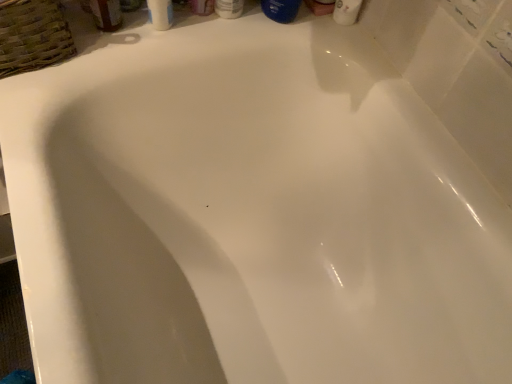
Question: From the image's perspective, would you say matte plastic bottle at upper center, the second toiletry from the right, is shown under woven brown basket at upper left?

Choices:
 (A) yes
 (B) no

Answer: (B)

Question: Does matte plastic bottle at upper center, the second toiletry from the right, have a larger size compared to woven brown basket at upper left?

Choices:
 (A) yes
 (B) no

Answer: (B)

Question: Can you confirm if matte plastic bottle at upper center, the first toiletry when ordered from left to right, is smaller than woven brown basket at upper left?

Choices:
 (A) yes
 (B) no

Answer: (A)

Question: From a real-world perspective, is matte plastic bottle at upper center, the second toiletry from the right, over woven brown basket at upper left?

Choices:
 (A) yes
 (B) no

Answer: (A)

Question: Can you confirm if matte plastic bottle at upper center, the second toiletry from the right, is thinner than woven brown basket at upper left?

Choices:
 (A) yes
 (B) no

Answer: (A)

Question: Can you confirm if matte plastic bottle at upper center, the second toiletry from the right, is positioned to the left of woven brown basket at upper left?

Choices:
 (A) no
 (B) yes

Answer: (A)

Question: Does white glossy bottle at upper center, the 1th toiletry in the right-to-left sequence, have a lesser height compared to translucent plastic mouthwash at upper left, the 2th mouthwash positioned from the right?

Choices:
 (A) yes
 (B) no

Answer: (B)

Question: Is white glossy bottle at upper center, the second toiletry from the left, bigger than translucent plastic mouthwash at upper left, the 2th mouthwash positioned from the right?

Choices:
 (A) no
 (B) yes

Answer: (B)

Question: Is white glossy bottle at upper center, the second toiletry from the left, looking in the opposite direction of translucent plastic mouthwash at upper left, the 2th mouthwash positioned from the right?

Choices:
 (A) yes
 (B) no

Answer: (B)

Question: Does white glossy bottle at upper center, the second toiletry from the left, come behind translucent plastic mouthwash at upper left, the 1th mouthwash viewed from the left?

Choices:
 (A) yes
 (B) no

Answer: (A)

Question: Can translucent plastic mouthwash at upper left, the 1th mouthwash viewed from the left, be found inside white glossy bottle at upper center, the 1th toiletry in the right-to-left sequence?

Choices:
 (A) yes
 (B) no

Answer: (B)

Question: Is white glossy bottle at upper center, the 1th toiletry in the right-to-left sequence, not inside translucent plastic mouthwash at upper left, the 2th mouthwash positioned from the right?

Choices:
 (A) no
 (B) yes

Answer: (B)

Question: Is white glossy bottle at upper center, the 1th toiletry in the right-to-left sequence, smaller than matte plastic bottle at upper center, the second toiletry from the right?

Choices:
 (A) yes
 (B) no

Answer: (B)